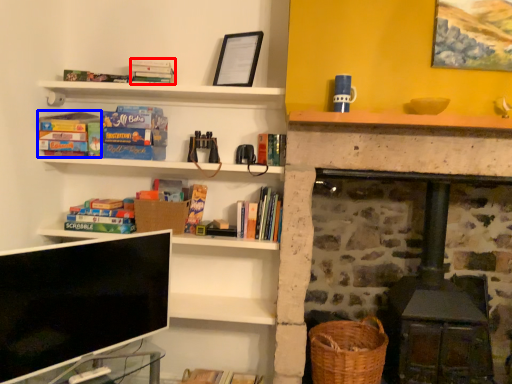
Question: Which object appears farthest to the camera in this image, book (highlighted by a red box) or book (highlighted by a blue box)?

Choices:
 (A) book
 (B) book

Answer: (B)